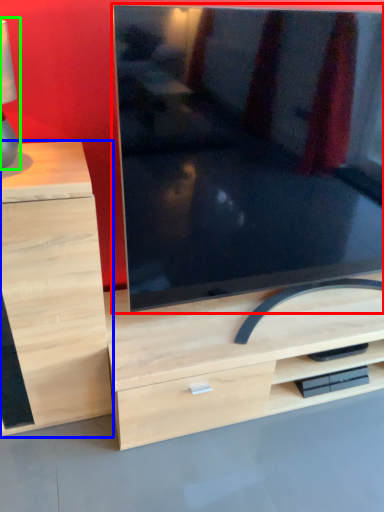
Question: Which object is positioned farthest from television (highlighted by a red box)? Select from chest of drawers (highlighted by a blue box) and table lamp (highlighted by a green box).

Choices:
 (A) chest of drawers
 (B) table lamp

Answer: (B)